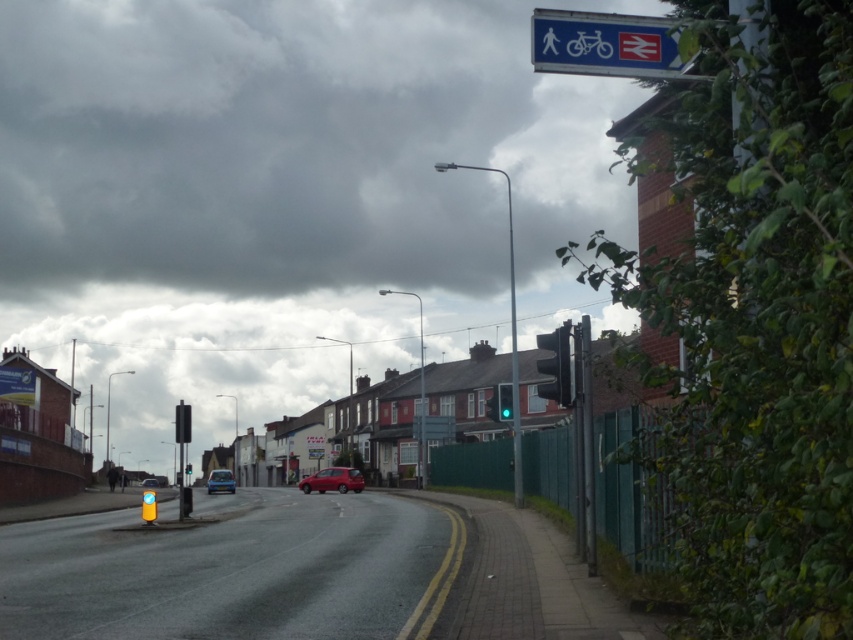
You are driving a car and need to stop at the traffic light. Based on the scene, which object is taller between the black matte traffic light at right and the matte blue car at center?

The black matte traffic light at right is taller than the matte blue car at center.

You are a delivery driver approaching the intersection shown in the image. You see the black matte traffic light at right and the matte blue car at center. Which object appears bigger in your view?

The black matte traffic light at right is larger in size than the matte blue car at center, so the traffic light appears bigger in your view.

You are a delivery person needing to park your van between the black matte traffic light at right and the camera. The van is 20 feet long. Is there enough space?

The black matte traffic light at right and camera are 38.53 feet apart from each other. Since the van is 20 feet long, there is enough space to park between them as 38.53 feet is greater than 20 feet.